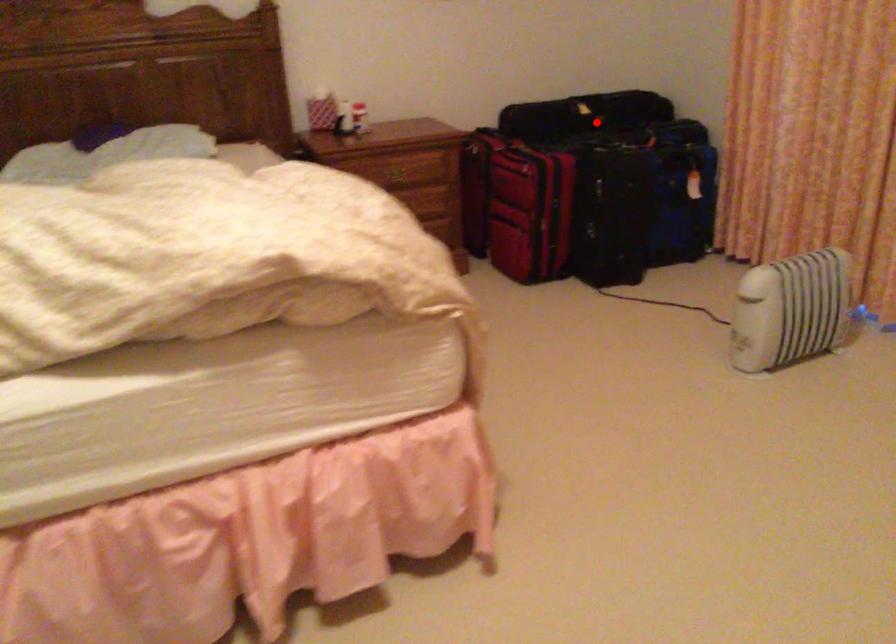
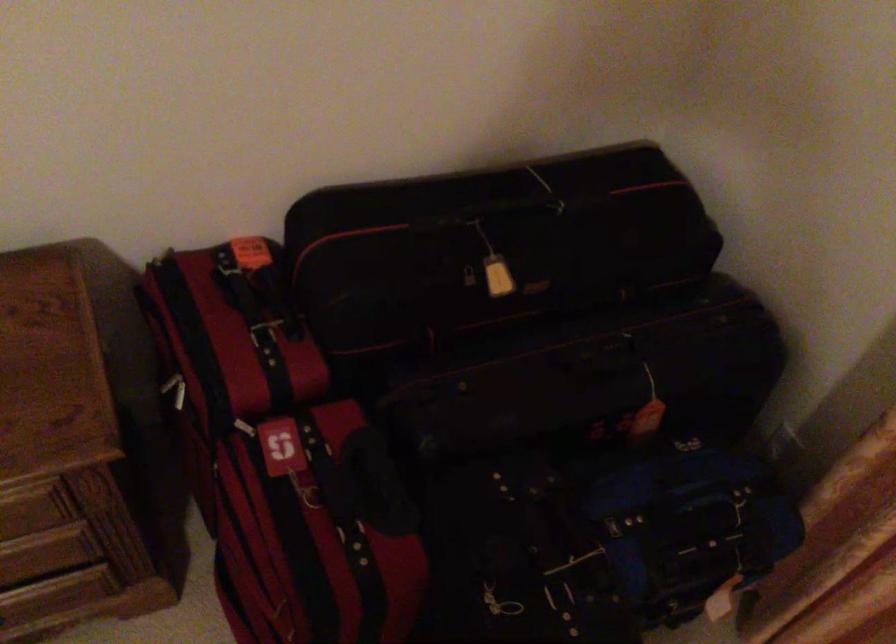
Find the pixel in the second image that matches the highlighted location in the first image.

(527, 357)